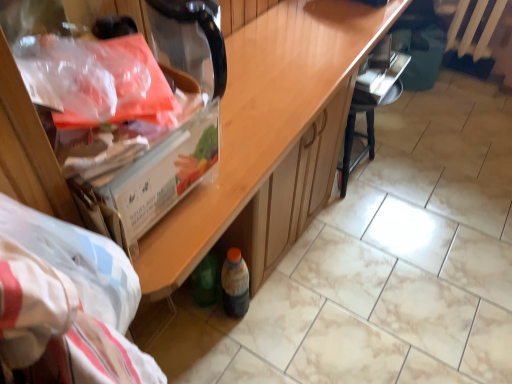
Question: Would you say metallic silver radiator at upper right is part of black wood chair at center's contents?

Choices:
 (A) no
 (B) yes

Answer: (A)

Question: Is black wood chair at center smaller than metallic silver radiator at upper right?

Choices:
 (A) no
 (B) yes

Answer: (A)

Question: Is black wood chair at center taller than metallic silver radiator at upper right?

Choices:
 (A) no
 (B) yes

Answer: (B)

Question: Is black wood chair at center at the left side of metallic silver radiator at upper right?

Choices:
 (A) yes
 (B) no

Answer: (A)

Question: Can you confirm if black wood chair at center is shorter than metallic silver radiator at upper right?

Choices:
 (A) yes
 (B) no

Answer: (B)

Question: From the image's perspective, is black wood chair at center located above metallic silver radiator at upper right?

Choices:
 (A) no
 (B) yes

Answer: (A)

Question: Does black wood chair at center have a smaller size compared to translucent plastic bag at upper left?

Choices:
 (A) no
 (B) yes

Answer: (A)

Question: Is translucent plastic bag at upper left completely or partially inside black wood chair at center?

Choices:
 (A) no
 (B) yes

Answer: (A)

Question: Does black wood chair at center have a larger size compared to translucent plastic bag at upper left?

Choices:
 (A) no
 (B) yes

Answer: (B)

Question: Does black wood chair at center touch translucent plastic bag at upper left?

Choices:
 (A) yes
 (B) no

Answer: (B)

Question: Is black wood chair at center aimed at translucent plastic bag at upper left?

Choices:
 (A) yes
 (B) no

Answer: (B)

Question: Does black wood chair at center have a lesser height compared to translucent plastic bag at upper left?

Choices:
 (A) no
 (B) yes

Answer: (A)

Question: Does translucent plastic bottle at lower center have a greater height compared to translucent plastic bag at upper left?

Choices:
 (A) no
 (B) yes

Answer: (B)